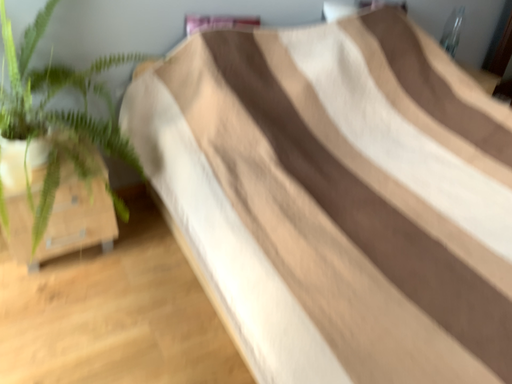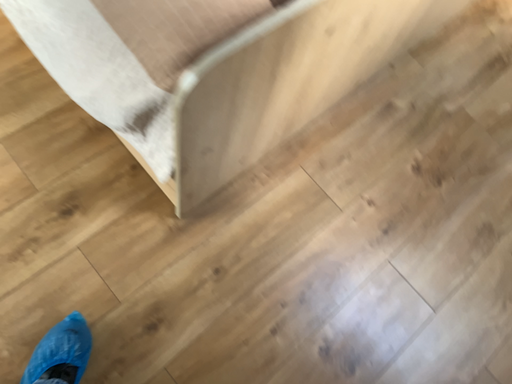
Question: How did the camera likely rotate when shooting the video?

Choices:
 (A) rotated right
 (B) rotated left

Answer: (A)